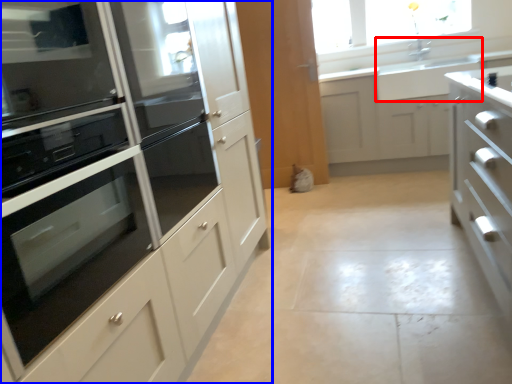
Question: Among these objects, which one is farthest to the camera, sink (highlighted by a red box) or cabinetry (highlighted by a blue box)?

Choices:
 (A) sink
 (B) cabinetry

Answer: (A)